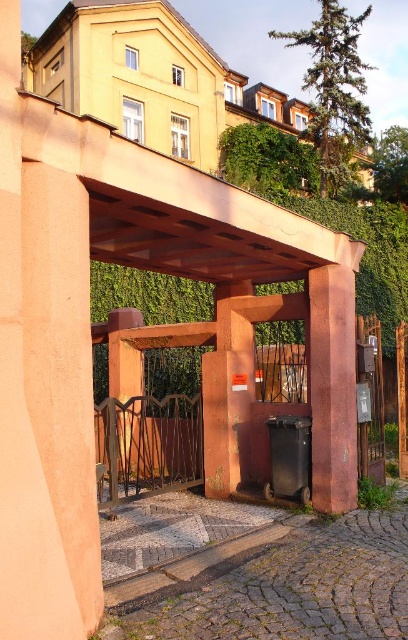
Is rustic stone pillar at center bigger than brown wood gate at center?

No, rustic stone pillar at center is not bigger than brown wood gate at center.

Does rustic stone pillar at center have a greater height compared to brown wood gate at center?

Indeed, rustic stone pillar at center has a greater height compared to brown wood gate at center.

Image resolution: width=408 pixels, height=640 pixels. I want to click on rustic stone pillar at center, so click(332, 387).